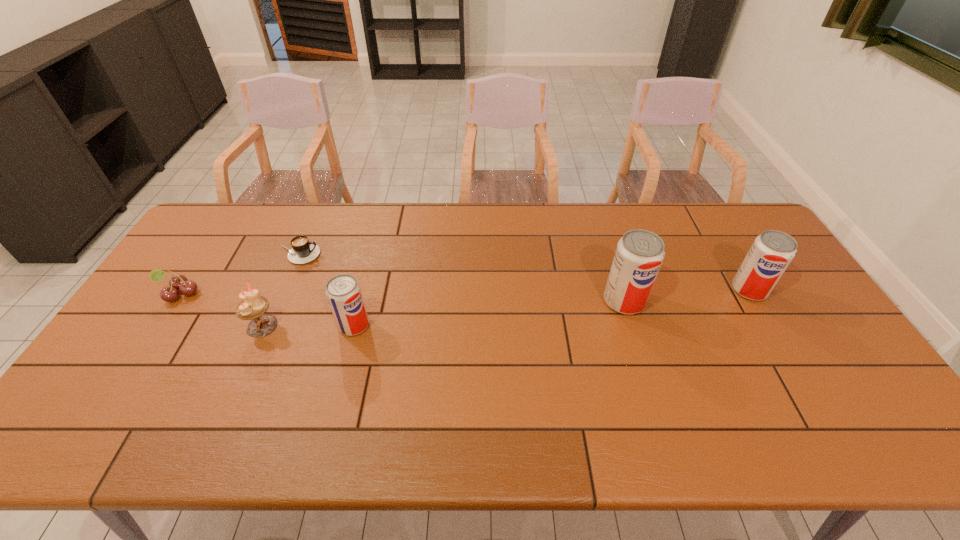
Locate an element on the screen. The width and height of the screenshot is (960, 540). free space that satisfies the following two spatial constraints: 1. with the handle on the side of the farthest object; 2. on the leaves of the leftmost object is located at coordinates (281, 293).

Where is `blank space that satisfies the following two spatial constraints: 1. on the back side of the second tallest soda; 2. with the handle on the side of the cappuccino`? This screenshot has height=540, width=960. blank space that satisfies the following two spatial constraints: 1. on the back side of the second tallest soda; 2. with the handle on the side of the cappuccino is located at coordinates [728, 254].

This screenshot has width=960, height=540. What are the coordinates of `free space that satisfies the following two spatial constraints: 1. with the handle on the side of the second object from right to left; 2. on the left side of the shortest object` in the screenshot? It's located at (278, 301).

The width and height of the screenshot is (960, 540). In order to click on free space that satisfies the following two spatial constraints: 1. on the leaves of the cherry; 2. on the left side of the second soda from right to left in this screenshot , I will do `click(175, 301)`.

This screenshot has height=540, width=960. I want to click on free region that satisfies the following two spatial constraints: 1. with the handle on the side of the cappuccino; 2. on the leaves of the second shortest object, so click(x=281, y=293).

The image size is (960, 540). I want to click on vacant space that satisfies the following two spatial constraints: 1. on the back side of the fourth object from left to right; 2. on the right side of the fifth object from left to right, so click(x=360, y=301).